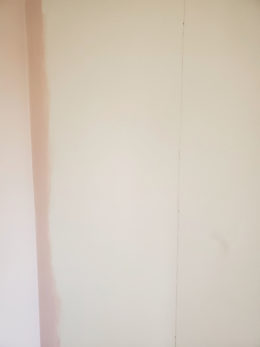
The height and width of the screenshot is (347, 260). In order to click on wall in this screenshot , I will do `click(211, 243)`.